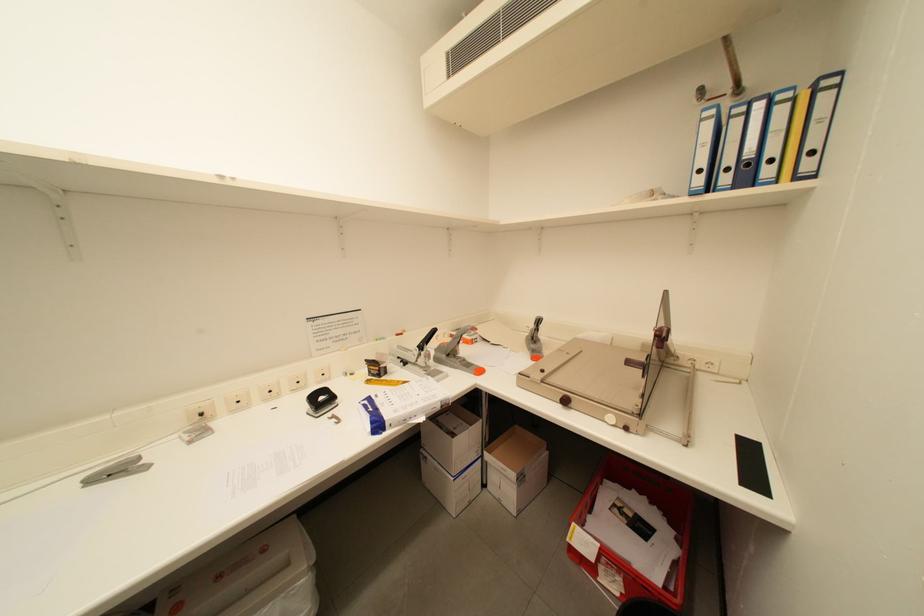
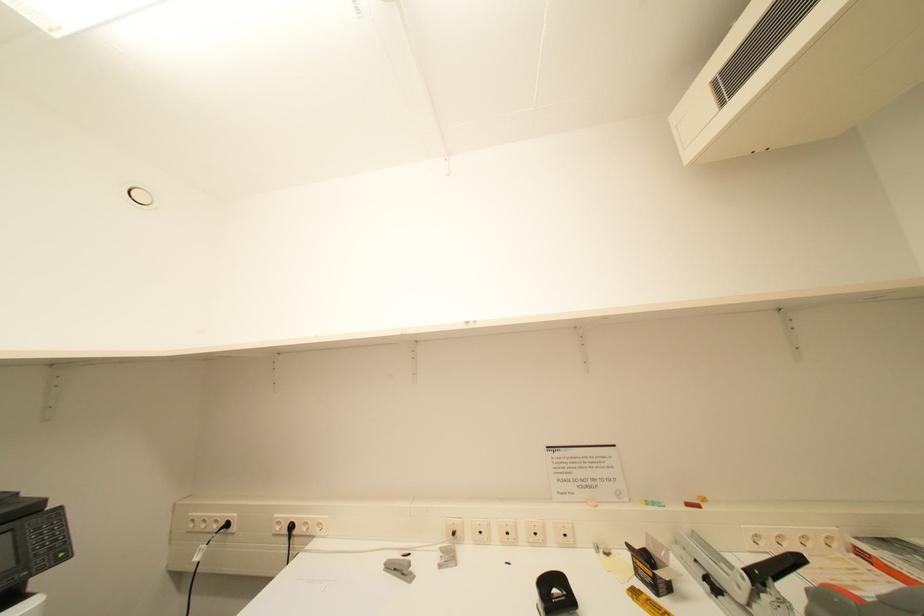
In the scene shown: How did the camera likely rotate?

The rotation direction of the camera is left-up.